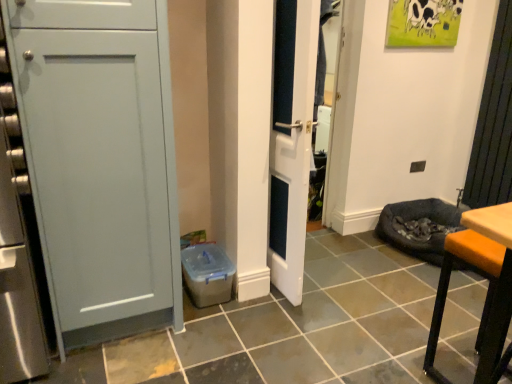
At what (x,y) coordinates should I click in order to perform the action: click on orange leather stool at lower right. Please return your answer as a coordinate pair (x, y). The width and height of the screenshot is (512, 384). Looking at the image, I should click on (487, 291).

Describe the element at coordinates (487, 291) in the screenshot. This screenshot has height=384, width=512. I see `orange leather stool at lower right` at that location.

Where is `white glossy door at center`? The image size is (512, 384). white glossy door at center is located at coordinates (291, 140).

Image resolution: width=512 pixels, height=384 pixels. Describe the element at coordinates (291, 140) in the screenshot. I see `white glossy door at center` at that location.

At what (x,y) coordinates should I click in order to perform the action: click on orange leather stool at lower right. Please return your answer as a coordinate pair (x, y). Looking at the image, I should click on (487, 291).

Does orange leather stool at lower right appear on the right side of white glossy door at center?

Correct, you'll find orange leather stool at lower right to the right of white glossy door at center.

Is orange leather stool at lower right in front of white glossy door at center?

Yes.

Is point (492, 345) positioned after point (307, 195)?

No, (492, 345) is closer to viewer.

From the image's perspective, which is below, orange leather stool at lower right or white glossy door at center?

From the image's view, orange leather stool at lower right is below.

From a real-world perspective, is orange leather stool at lower right positioned under white glossy door at center based on gravity?

Yes, from a real-world perspective, orange leather stool at lower right is under white glossy door at center.

Which object is wider, orange leather stool at lower right or white glossy door at center?

Wider between the two is orange leather stool at lower right.

Is orange leather stool at lower right shorter than white glossy door at center?

Correct, orange leather stool at lower right is not as tall as white glossy door at center.

In terms of size, does orange leather stool at lower right appear bigger or smaller than white glossy door at center?

orange leather stool at lower right is smaller than white glossy door at center.

Is white glossy door at center surrounded by orange leather stool at lower right?

That's incorrect, white glossy door at center is not inside orange leather stool at lower right.

Is orange leather stool at lower right far from white glossy door at center?

orange leather stool at lower right is near white glossy door at center, not far away.

Is orange leather stool at lower right turned away from white glossy door at center?

That's not correct — orange leather stool at lower right is not looking away from white glossy door at center.

How many degrees apart are the facing directions of orange leather stool at lower right and white glossy door at center?

The facing directions of orange leather stool at lower right and white glossy door at center are 95.6 degrees apart.

Identify the location of furniture to the right of white glossy door at center. The height and width of the screenshot is (384, 512). (487, 291).

Visually, is white glossy door at center positioned to the left or to the right of orange leather stool at lower right?

white glossy door at center is positioned on orange leather stool at lower right's left side.

Is white glossy door at center in front of orange leather stool at lower right?

That is False.

Is point (312, 79) closer to viewer compared to point (494, 344)?

No.

Based on the photo, from the image's perspective, which one is positioned higher, white glossy door at center or orange leather stool at lower right?

From the image's view, white glossy door at center is above.

From a real-world perspective, is white glossy door at center located beneath orange leather stool at lower right?

No.

Considering the sizes of objects white glossy door at center and orange leather stool at lower right in the image provided, who is thinner, white glossy door at center or orange leather stool at lower right?

Thinner between the two is white glossy door at center.

Between white glossy door at center and orange leather stool at lower right, which one has less height?

Standing shorter between the two is orange leather stool at lower right.

Is white glossy door at center smaller than orange leather stool at lower right?

Actually, white glossy door at center might be larger than orange leather stool at lower right.

Is orange leather stool at lower right located within white glossy door at center?

No, orange leather stool at lower right is not surrounded by white glossy door at center.

Based on the photo, would you say white glossy door at center is a long distance from orange leather stool at lower right?

white glossy door at center is actually quite close to orange leather stool at lower right.

Is white glossy door at center looking in the opposite direction of orange leather stool at lower right?

No, white glossy door at center's orientation is not away from orange leather stool at lower right.

What's the angular difference between white glossy door at center and orange leather stool at lower right's facing directions?

95.6 degrees.

In order to click on furniture that is under the white glossy door at center (from a real-world perspective) in this screenshot , I will do `click(487, 291)`.

Locate an element on the screen. This screenshot has height=384, width=512. furniture that appears on the right of white glossy door at center is located at coordinates (487, 291).

Where is `door above the orange leather stool at lower right (from a real-world perspective)`? door above the orange leather stool at lower right (from a real-world perspective) is located at coordinates (291, 140).